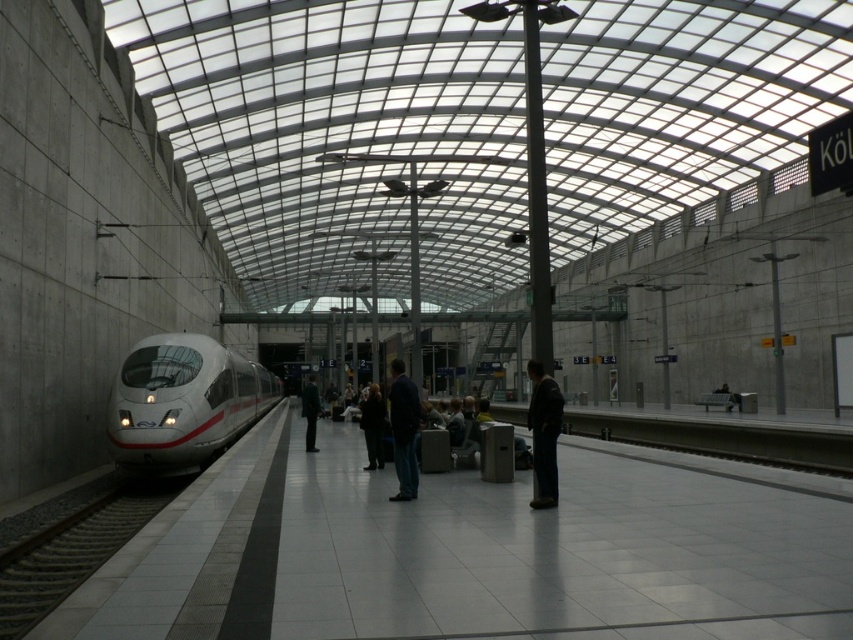
Does blue denim jeans at center have a larger size compared to dark brown leather jacket at center?

Yes, blue denim jeans at center is bigger than dark brown leather jacket at center.

Is blue denim jeans at center thinner than dark brown leather jacket at center?

In fact, blue denim jeans at center might be wider than dark brown leather jacket at center.

Between point (418, 403) and point (369, 451), which one is positioned behind?

The point (369, 451) is behind.

Locate an element on the screen. This screenshot has width=853, height=640. blue denim jeans at center is located at coordinates (403, 429).

Is white glossy train at left smaller than dark brown leather jacket at center?

Actually, white glossy train at left might be larger than dark brown leather jacket at center.

Is white glossy train at left bigger than dark brown leather jacket at center?

Yes, white glossy train at left is bigger than dark brown leather jacket at center.

Between point (173, 365) and point (360, 406), which one is positioned behind?

The point (360, 406) is behind.

You are a GUI agent. You are given a task and a screenshot of the screen. Output one action in this format:
    pyautogui.click(x=<x>, y=<y>)
    Task: Click on the white glossy train at left
    Image resolution: width=853 pixels, height=640 pixels.
    Given the screenshot: What is the action you would take?
    pyautogui.click(x=183, y=403)

In the scene shown: Who is lower down, white glossy train at left or dark green jacket at center?

dark green jacket at center is lower down.

Who is more forward, (236, 408) or (311, 442)?

Point (311, 442) is more forward.

Locate an element on the screen. Image resolution: width=853 pixels, height=640 pixels. white glossy train at left is located at coordinates (183, 403).